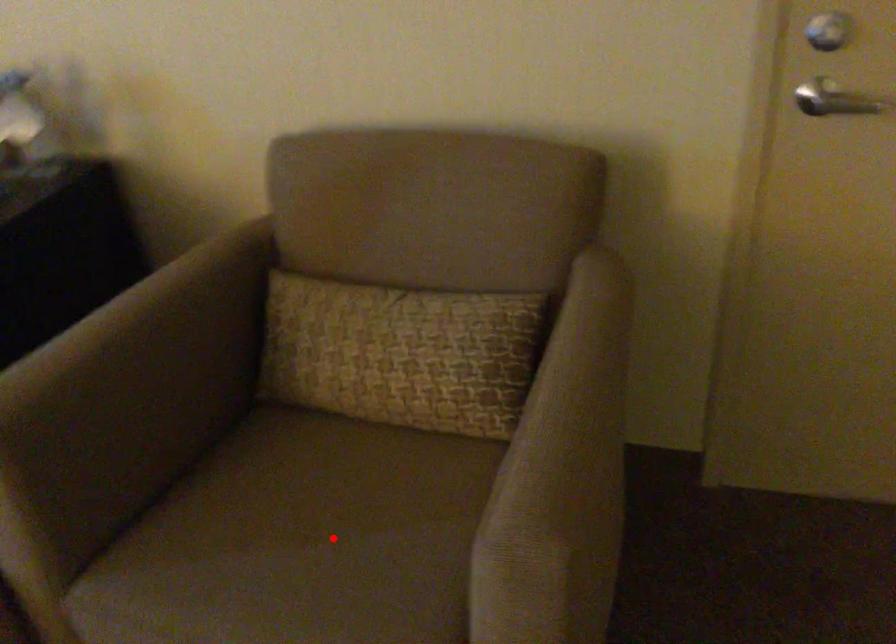
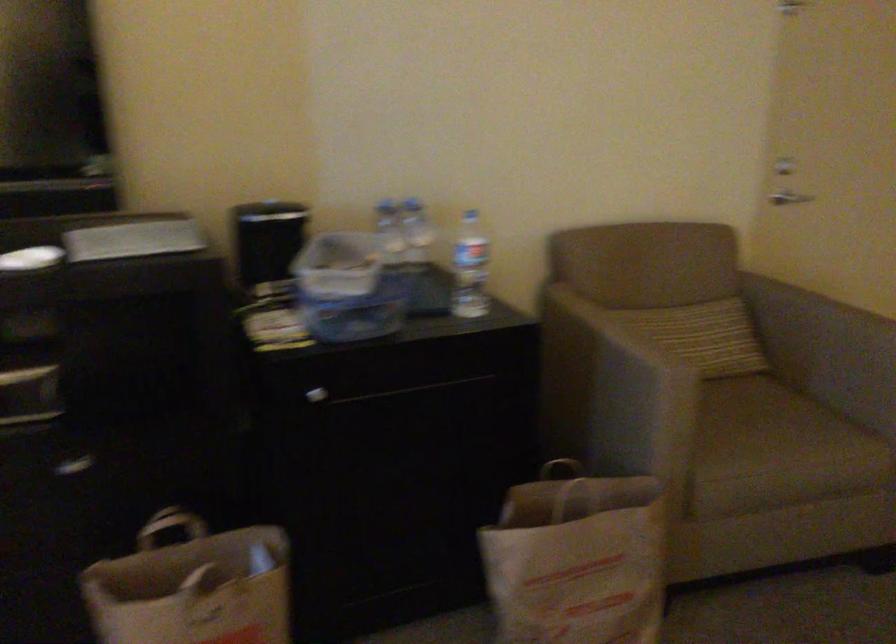
Question: I am providing you with two images of the same scene from different viewpoints. Given a red point in image1, look at the same physical point in image2. Is it:

Choices:
 (A) Closer to the viewpoint
 (B) Farther from the viewpoint

Answer: (B)